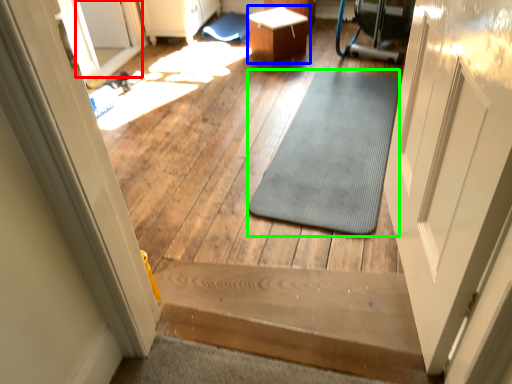
Question: Which is farther away from glass door (highlighted by a red box)? table (highlighted by a blue box) or mat (highlighted by a green box)?

Choices:
 (A) table
 (B) mat

Answer: (B)